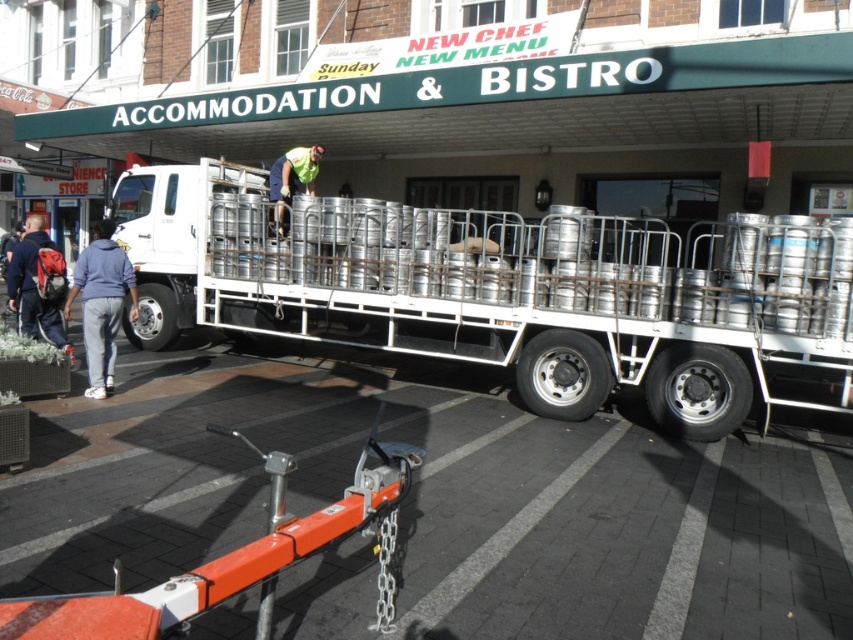
Looking at this image, you are a delivery driver who just arrived at the accommodation and bistro. You need to check if the metallic silver kegs at center are positioned safely below the green reflective vest at center before driving away. Is this the case?

Yes, the metallic silver kegs at center are positioned safely below the green reflective vest at center as described.

You are standing on the sidewalk and looking at the white flatbed truck. There are two points marked on the truck bed. Which point is closer to you, point 1 at coordinates (91,310) or point 2 at coordinates (283,161)?

Point 1 at coordinates (91,310) is closer to you than point 2 at coordinates (283,161).

You are a delivery driver who needs to ensure that the metallic silver kegs at center and the green reflective vest at center fit within the truck bed. Given that the truck bed has a width limit of 1 meter, can both items be placed side by side without exceeding the width limit?

The metallic silver kegs at center is wider than the green reflective vest at center. Since the truck bed has a width limit of 1 meter, the combined width of both items would exceed the limit, making it impossible to place them side by side without exceeding the width limit.